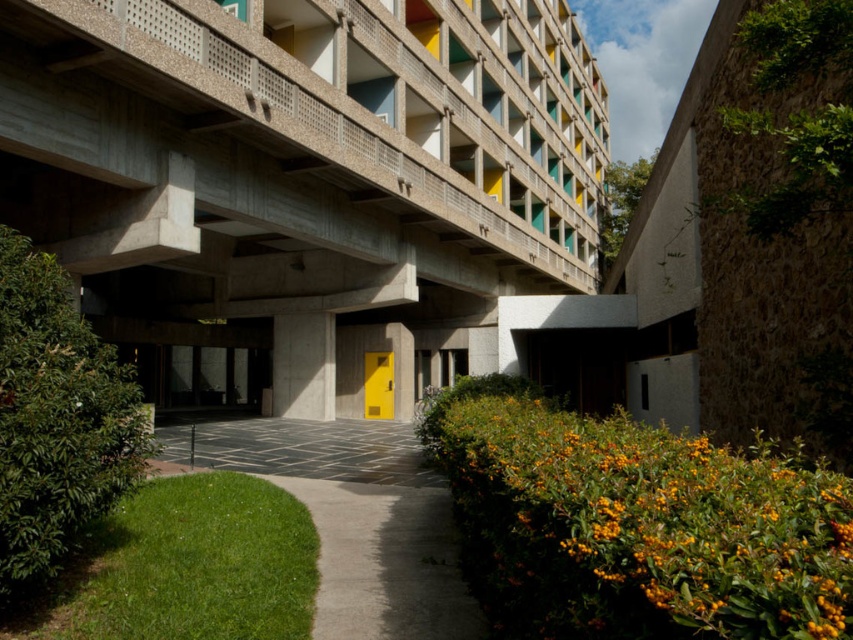
You are standing at the entrance of the building and notice the concrete at upper center and the concrete pillar at center. Which of these two structures is taller?

The concrete at upper center is taller than the concrete pillar at center.